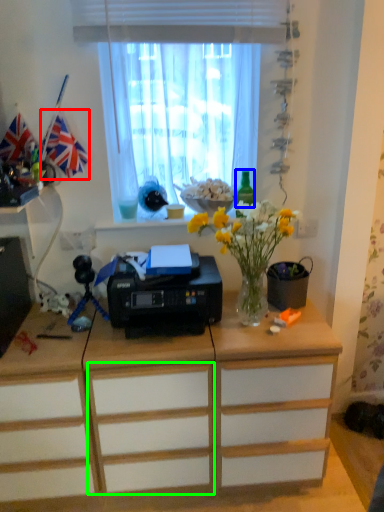
Question: Which object is positioned closest to flag (highlighted by a red box)? Select from bottle (highlighted by a blue box) and drawer (highlighted by a green box).

Choices:
 (A) bottle
 (B) drawer

Answer: (A)